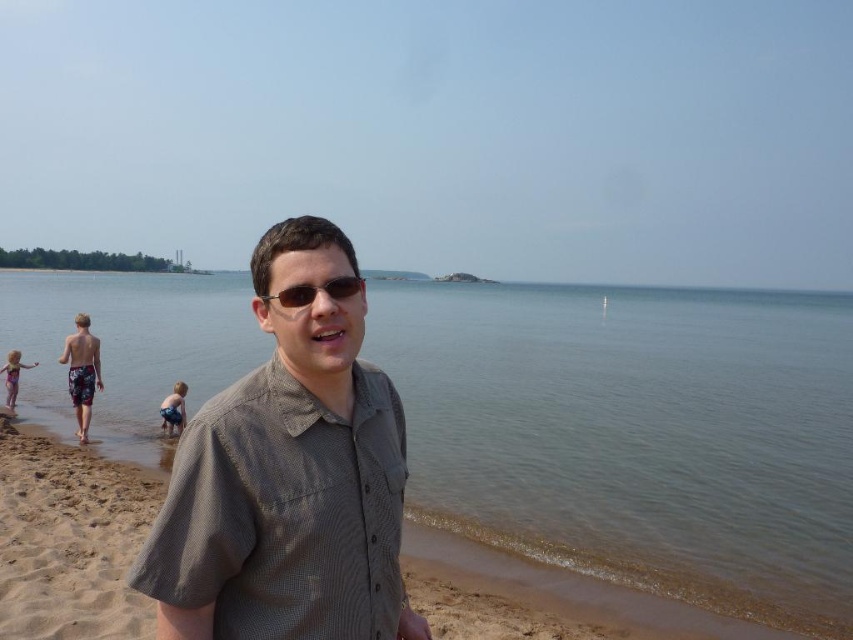
Question: Which object is positioned farthest from the brown textured shirt at center?

Choices:
 (A) light pink swimsuit at lower left
 (B) clear water at beach front
 (C) blue denim shorts at lower left
 (D) sunglasses at center

Answer: (B)

Question: Is sunglasses at center bigger than light pink swimsuit at lower left?

Choices:
 (A) no
 (B) yes

Answer: (A)

Question: In this image, where is sunglasses at center located relative to blue denim shorts at lower left?

Choices:
 (A) left
 (B) right

Answer: (B)

Question: Which point is closer to the camera taking this photo?

Choices:
 (A) 280,570
 (B) 589,493
 (C) 300,291
 (D) 173,401

Answer: (A)

Question: Can you confirm if brown textured shirt at center is smaller than sunglasses at center?

Choices:
 (A) yes
 (B) no

Answer: (B)

Question: Based on their relative distances, which object is farther from the brown textured shirt at center?

Choices:
 (A) clear water at beach front
 (B) light pink swimsuit at lower left
 (C) blue denim shorts at lower left

Answer: (A)